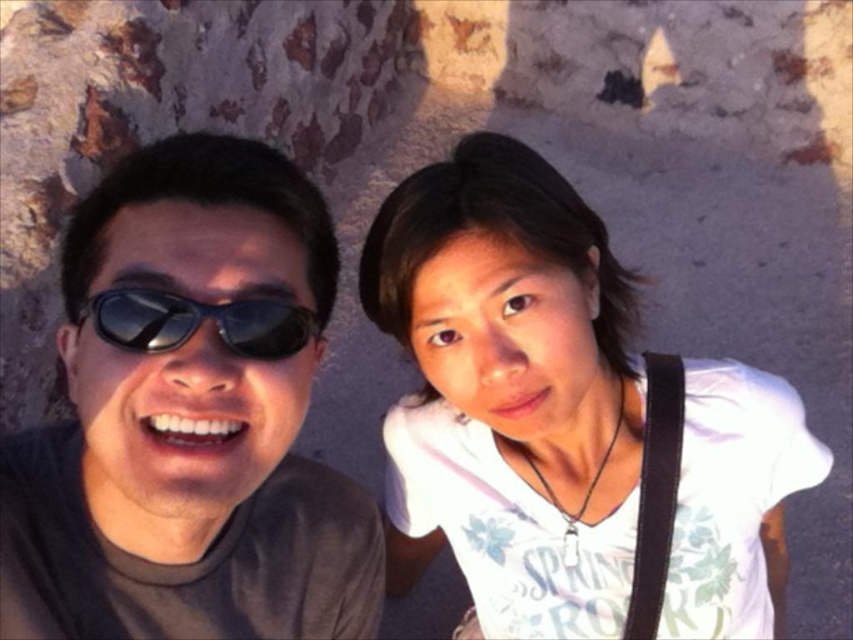
Consider the image. You are a photographer trying to capture a closeup of the sunglasses on the man at left. Since the matte black sunglasses at left and black reflective sunglasses at left are very close, can you focus on one without the other being in the frame?

The distance between the matte black sunglasses at left and black reflective sunglasses at left is 7.39 inches. Since they are positioned close together, it might be challenging to focus on one without the other being in the frame unless using a very narrow aperture or a telephoto lens to blur the background.

You are standing in front of the camera and want to know how far the point at coordinates (500, 572) is from the camera. Can you determine the distance?

The point at coordinates (500, 572) is 4.81 feet away from the camera.

You are a photographer trying to capture a closeup of both the matte black sunglasses at left and the black reflective sunglasses at left. Since the camera can only focus on one pair at a time, which sunglasses should you choose to ensure the entire frame includes both pairs without cropping?

The matte black sunglasses at left are wider than the black reflective sunglasses at left. To include both pairs in the frame without cropping, focus on the matte black sunglasses at left as they occupy more space, allowing the narrower black reflective sunglasses at left to fit alongside within the camera view.